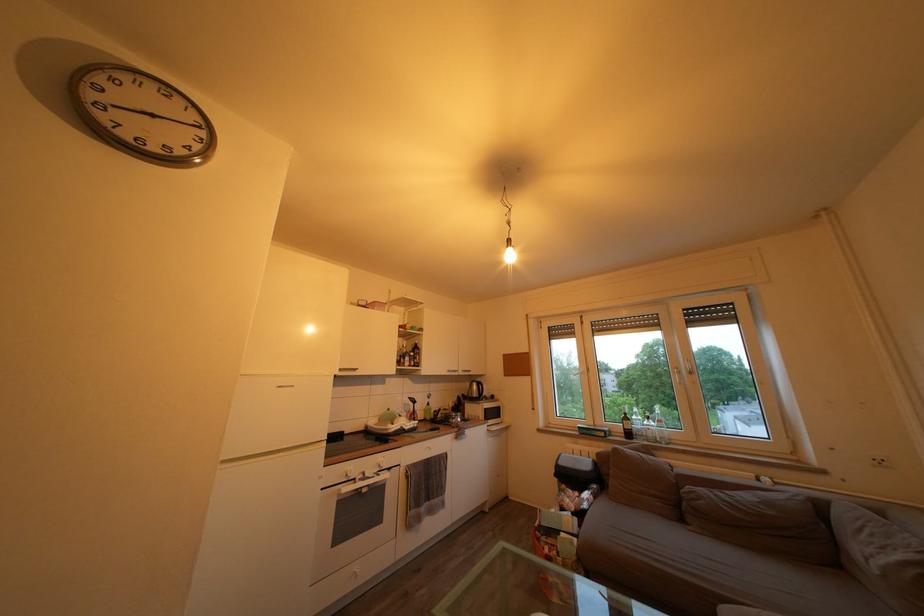
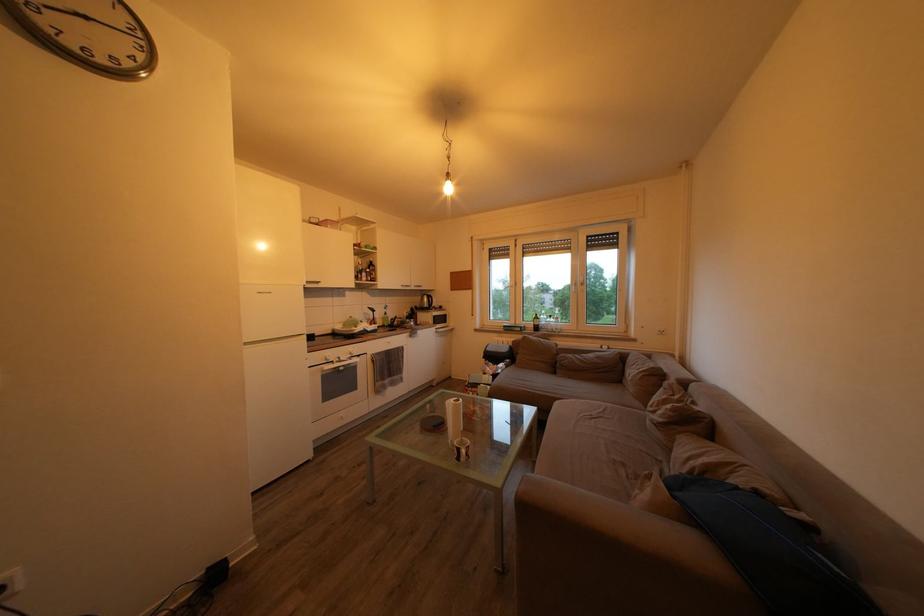
Question: The first image is from the beginning of the video and the second image is from the end. How did the camera likely rotate when shooting the video?

Choices:
 (A) Left
 (B) Right
 (C) Up
 (D) Down

Answer: (D)